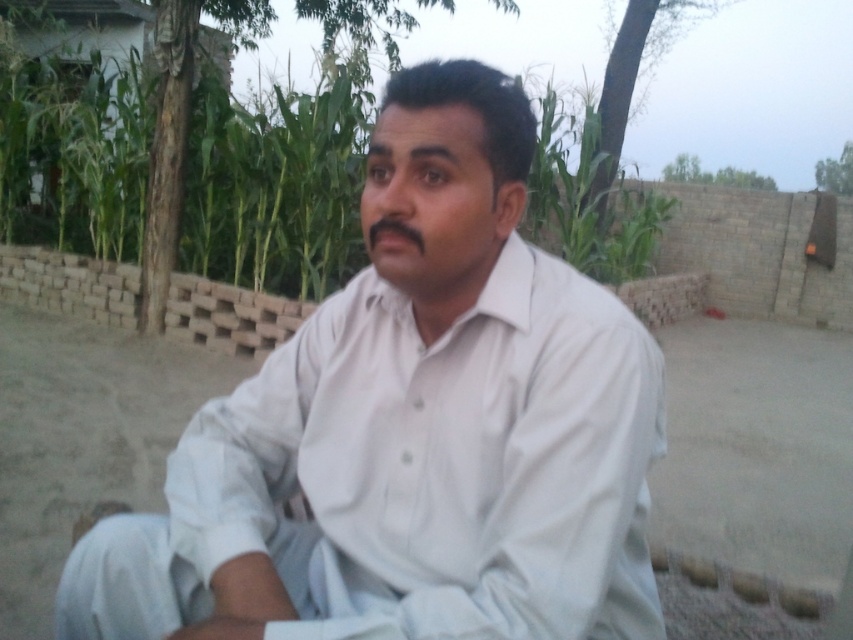
In the scene shown: You are a photographer standing at the edge of a field. You see a man wearing a white cotton shirt at center and green leafy corn at center in the scene. Can you fit both subjects into a single photo without moving your position? Explain why or why not based on their distance apart.

The distance between the white cotton shirt at center and the green leafy corn at center is 15.52 feet. Depending on the camera lens used, it may be possible to capture both in a single frame if the field of view accommodates this distance from your current position.